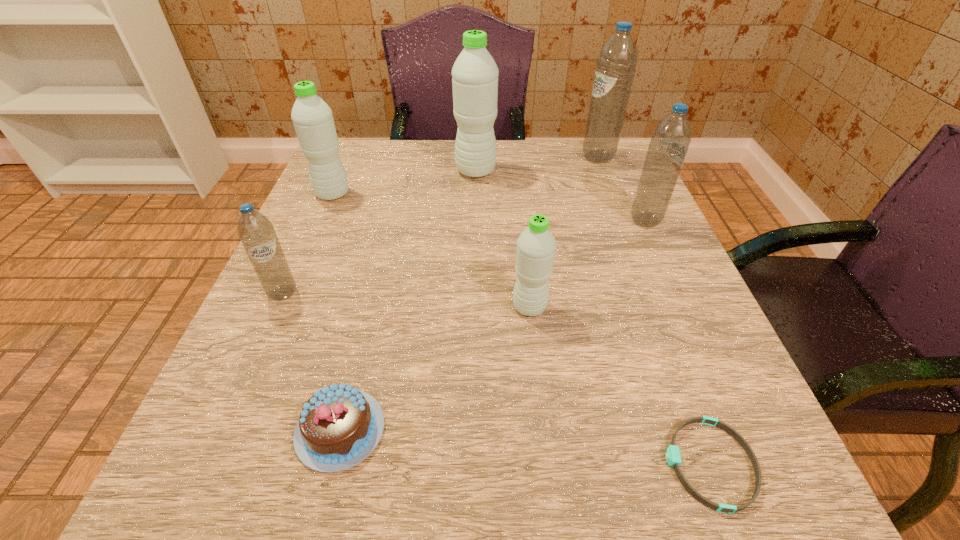
This screenshot has height=540, width=960. I want to click on vacant space that's between the fifth nearest object and the nearest blue water bottle, so click(x=464, y=257).

Identify the location of free spot between the smallest blue water bottle and the fourth farthest water bottle. The height and width of the screenshot is (540, 960). (464, 257).

I want to click on free space that is in between the sixth object from right to left and the nearest blue water bottle, so click(312, 362).

You are a GUI agent. You are given a task and a screenshot of the screen. Output one action in this format:
    pyautogui.click(x=<x>, y=<y>)
    Task: Click on the vacant space that's between the wristband and the third farthest object
    This screenshot has width=960, height=540.
    Given the screenshot: What is the action you would take?
    pyautogui.click(x=521, y=329)

Where is `empty space that is in between the farthest blue water bottle and the smallest blue water bottle`? This screenshot has width=960, height=540. empty space that is in between the farthest blue water bottle and the smallest blue water bottle is located at coordinates (441, 225).

Where is `blank region between the fourth object from right to left and the farthest blue water bottle`? The height and width of the screenshot is (540, 960). blank region between the fourth object from right to left and the farthest blue water bottle is located at coordinates (564, 232).

Locate an element on the screen. free spot between the wristband and the nearest blue water bottle is located at coordinates (496, 379).

You are a GUI agent. You are given a task and a screenshot of the screen. Output one action in this format:
    pyautogui.click(x=<x>, y=<y>)
    Task: Click on the free space between the biggest blue water bottle and the second smallest green water bottle
    This screenshot has width=960, height=540.
    Given the screenshot: What is the action you would take?
    pyautogui.click(x=466, y=176)

Select which object is the seventh closest to the nearest blue water bottle. Please provide its 2D coordinates. Your answer should be formatted as a tuple, i.e. [(x, y)], where the tuple contains the x and y coordinates of a point satisfying the conditions above.

[(616, 63)]

Identify which object is located as the fifth nearest to the fourth nearest water bottle. Please provide its 2D coordinates. Your answer should be formatted as a tuple, i.e. [(x, y)], where the tuple contains the x and y coordinates of a point satisfying the conditions above.

[(616, 63)]